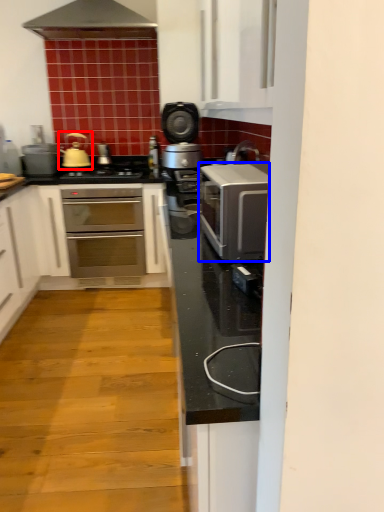
Question: Which object is further to the camera taking this photo, tea pot (highlighted by a red box) or kitchen appliance (highlighted by a blue box)?

Choices:
 (A) tea pot
 (B) kitchen appliance

Answer: (A)